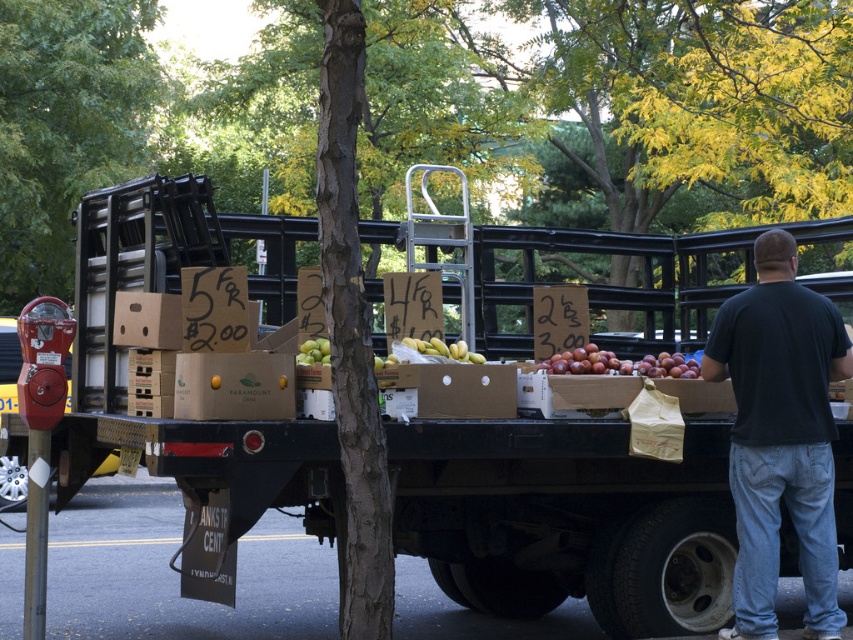
Between brown cardboard boxes at center and black cotton shirt at right, which one appears on the right side from the viewer's perspective?

From the viewer's perspective, black cotton shirt at right appears more on the right side.

Is brown cardboard boxes at center bigger than black cotton shirt at right?

Indeed, brown cardboard boxes at center has a larger size compared to black cotton shirt at right.

Locate an element on the screen. brown cardboard boxes at center is located at coordinates (567, 518).